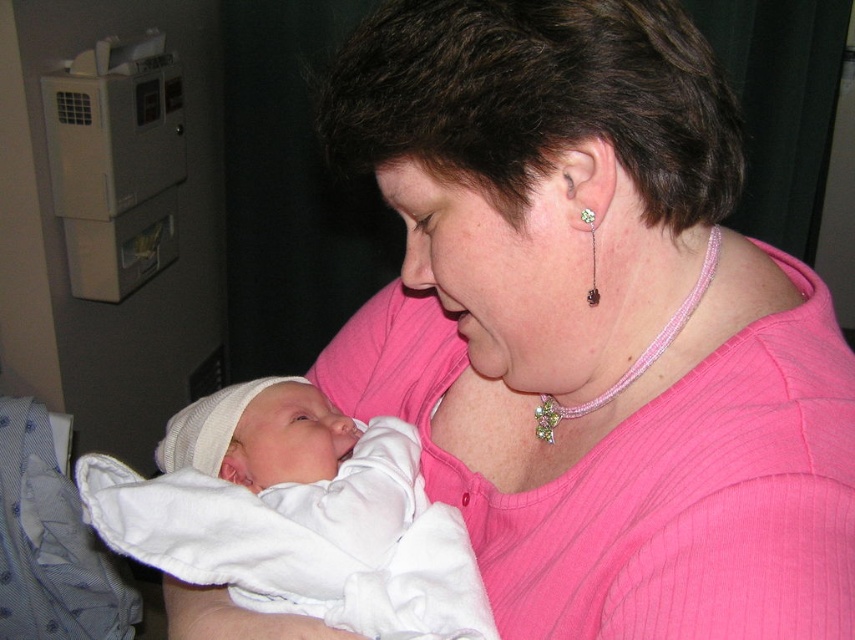
Question: Does white soft cloth at center appear under pink beaded necklace at center?

Choices:
 (A) no
 (B) yes

Answer: (B)

Question: Considering the real-world distances, which object is farthest from the pink beaded necklace at center?

Choices:
 (A) white soft cloth at center
 (B) green crystal earring at ear

Answer: (A)

Question: Considering the real-world distances, which object is closest to the white soft cloth at center?

Choices:
 (A) pink beaded necklace at center
 (B) green crystal earring at ear

Answer: (A)

Question: Is white soft cloth at center to the right of pink beaded necklace at center from the viewer's perspective?

Choices:
 (A) no
 (B) yes

Answer: (A)

Question: Considering the real-world distances, which object is farthest from the pink beaded necklace at center?

Choices:
 (A) white soft cloth at center
 (B) green crystal earring at ear

Answer: (A)

Question: Is pink beaded necklace at center above green crystal earring at ear?

Choices:
 (A) yes
 (B) no

Answer: (B)